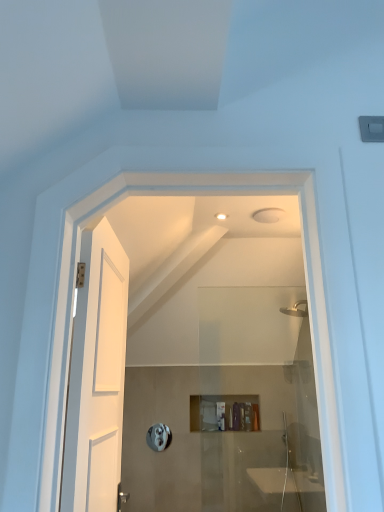
Question: Which is correct: silver metallic towel bar at center is inside matte plastic toiletry at center, which is counted as the 2th toiletry, starting from the left, or outside of it?

Choices:
 (A) outside
 (B) inside

Answer: (A)

Question: Considering the positions of point (157, 439) and point (256, 406), is point (157, 439) closer or farther from the camera than point (256, 406)?

Choices:
 (A) closer
 (B) farther

Answer: (A)

Question: Estimate the real-world distances between objects in this image. Which object is closer to the white wooden door at left?

Choices:
 (A) silver metallic towel bar at center
 (B) translucent plastic container at center, the 2th toiletry viewed from the right
 (C) matte plastic toiletry at center, which is counted as the 2th toiletry, starting from the left

Answer: (A)

Question: Estimate the real-world distances between objects in this image. Which object is closer to the translucent plastic container at center, the 2th toiletry viewed from the right?

Choices:
 (A) white wooden door at left
 (B) matte plastic toiletry at center, the first toiletry positioned from the right
 (C) silver metallic towel bar at center

Answer: (B)